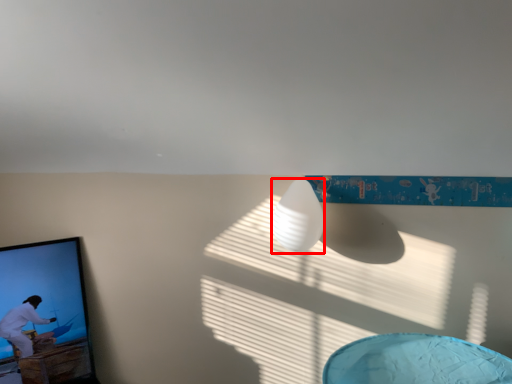
Question: In this image, where is lamp (annotated by the red box) located relative to picture frame?

Choices:
 (A) right
 (B) left

Answer: (A)